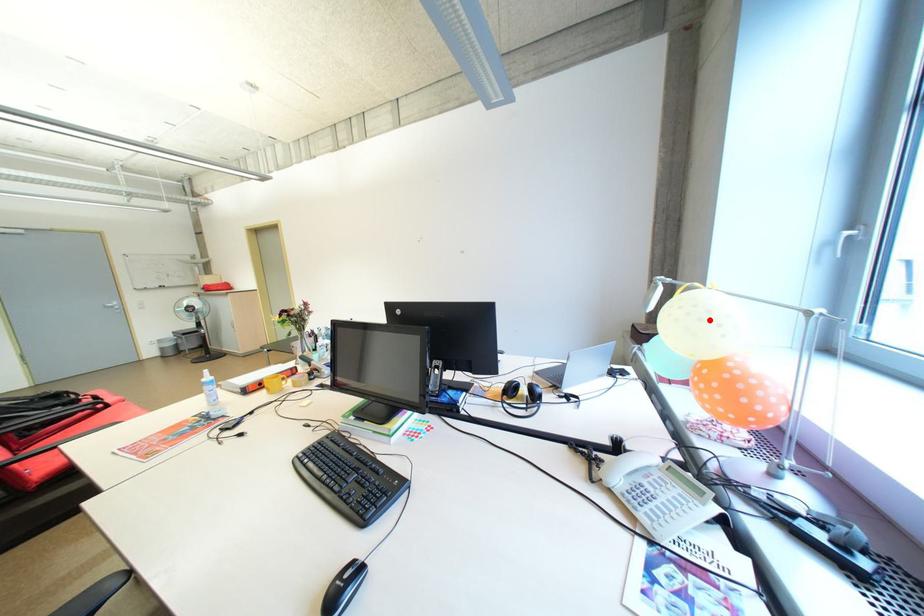
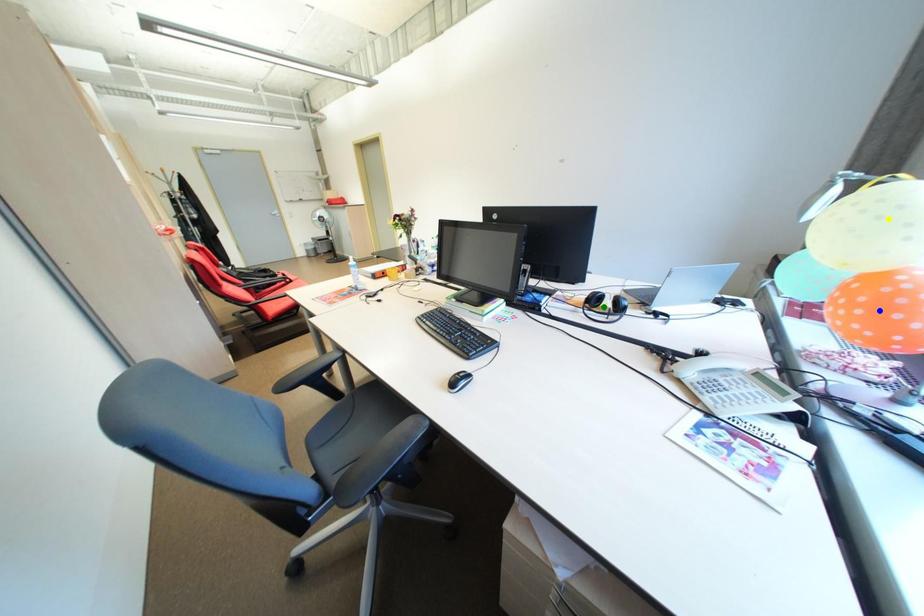
Question: I am providing you with two images of the same scene from different viewpoints. A red point is marked on the first image. You are given multiple points on the second image. Which point in image 2 represents the same 3d spot as the red point in image 1?

Choices:
 (A) yellow point
 (B) blue point
 (C) green point

Answer: (A)